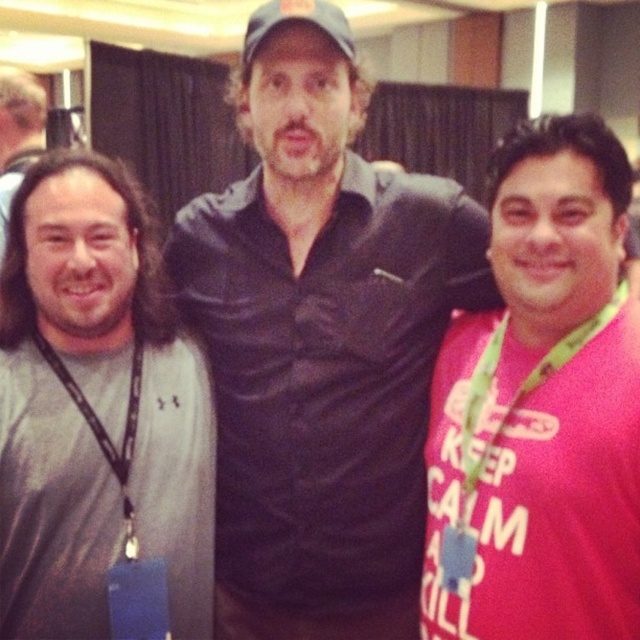
You are a photographer trying to adjust the composition of this group photo. You want to ensure that the green fabric lanyard at right and the gray fabric baseball cap at center are positioned so that they are at least 24 inches apart. Based on the scene, is the current spacing sufficient?

The distance between the green fabric lanyard at right and the gray fabric baseball cap at center is 24.98 inches, which is just over the required 24 inches. Therefore, the current spacing is sufficient.

Looking at this image, you are standing at the position of point (326, 10) and want to see the person at point (492, 348). Is there any obstruction between you and them?

Point (492, 348) is in front of point (326, 10), so there is no obstruction between you and them.